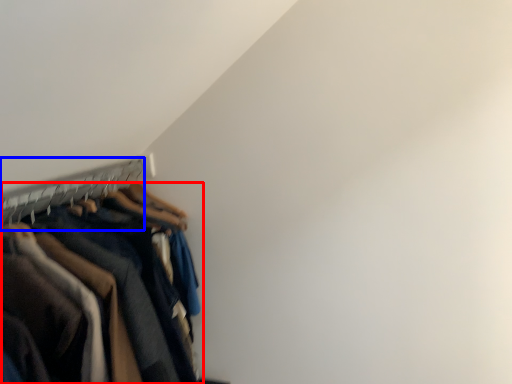
Question: Which object appears closest to the camera in this image, trousers (highlighted by a red box) or hanger (highlighted by a blue box)?

Choices:
 (A) trousers
 (B) hanger

Answer: (A)